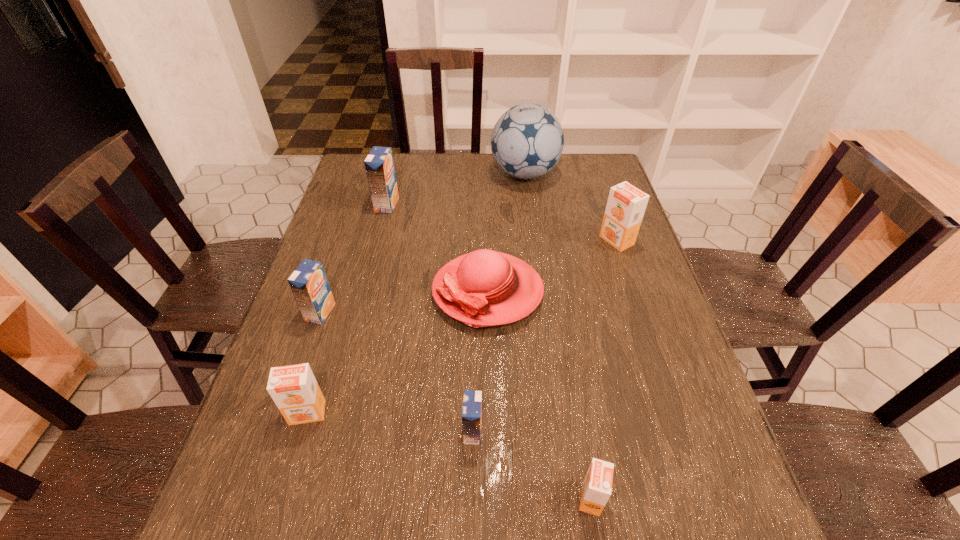
The width and height of the screenshot is (960, 540). What are the coordinates of `the tallest object` in the screenshot? It's located at click(x=527, y=141).

Locate an element on the screen. blue soccer ball is located at coordinates point(527,141).

Identify the location of the biggest blue orange_juice. The image size is (960, 540). (379, 164).

Find the location of a particular element. the farthest blue orange_juice is located at coordinates click(x=379, y=164).

Locate an element on the screen. The image size is (960, 540). the rightmost object is located at coordinates (626, 204).

Identify the location of the farthest orange orange juice. (626, 204).

The width and height of the screenshot is (960, 540). In order to click on the second nearest blue orange_juice in this screenshot , I will do `click(309, 284)`.

This screenshot has height=540, width=960. Identify the location of the second biggest blue orange_juice. (309, 284).

Where is `the second biggest orange orange juice`? The width and height of the screenshot is (960, 540). the second biggest orange orange juice is located at coordinates (294, 389).

Identify the location of the second nearest orange orange juice. Image resolution: width=960 pixels, height=540 pixels. (294, 389).